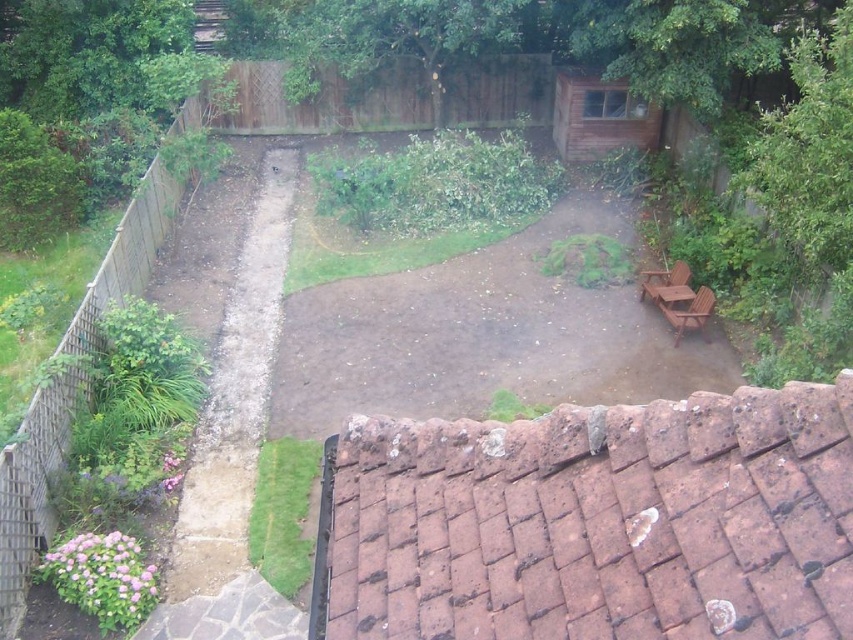
Question: Which object appears farthest from the camera in this image?

Choices:
 (A) brown wooden hut at upper right
 (B) green leafy tree at upper center

Answer: (A)

Question: Observing the image, what is the correct spatial positioning of green leafy tree at upper center in reference to brown wooden hut at upper right?

Choices:
 (A) above
 (B) below

Answer: (A)

Question: Which point is farther to the camera?

Choices:
 (A) (323, 17)
 (B) (567, 77)

Answer: (A)

Question: Which point is farther from the camera taking this photo?

Choices:
 (A) (601, 88)
 (B) (466, 26)
 (C) (833, 108)

Answer: (A)

Question: Can you confirm if green leafy tree at upper center is positioned below brown wooden hut at upper right?

Choices:
 (A) yes
 (B) no

Answer: (B)

Question: Does green leafy tree at upper center lie behind brown wooden hut at upper right?

Choices:
 (A) no
 (B) yes

Answer: (A)